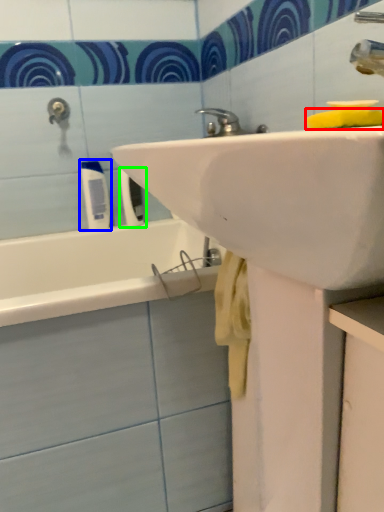
Question: Estimate the real-world distances between objects in this image. Which object is closer to soap (highlighted by a red box), toiletry (highlighted by a blue box) or toiletry (highlighted by a green box)?

Choices:
 (A) toiletry
 (B) toiletry

Answer: (B)